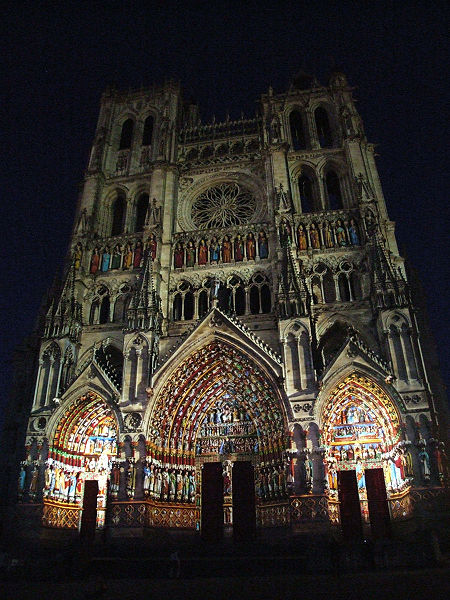
Where is `arch`? Image resolution: width=450 pixels, height=600 pixels. arch is located at coordinates click(x=219, y=428).